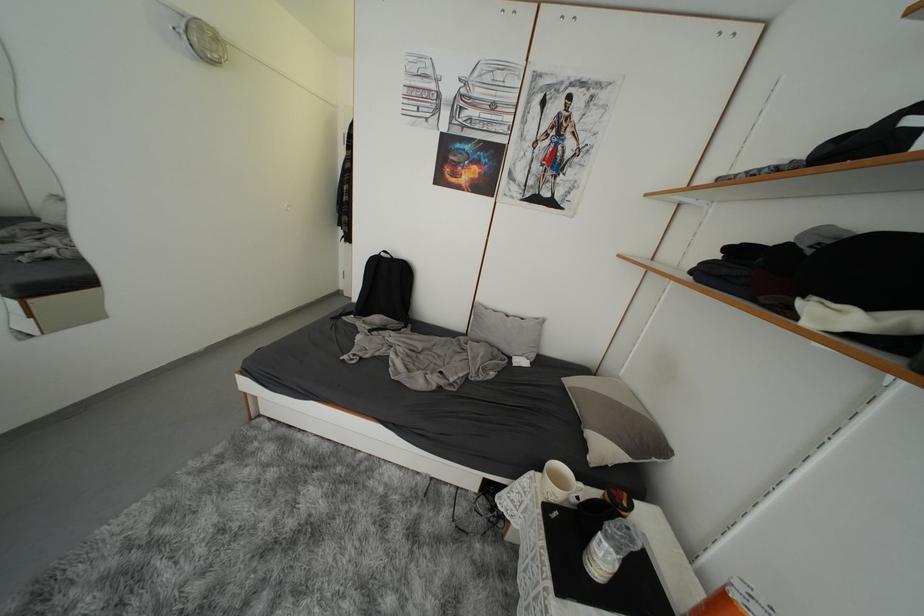
This screenshot has width=924, height=616. Identify the location of orange tape roll. (718, 604).